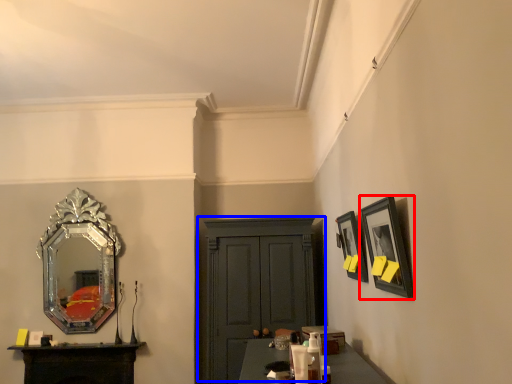
Question: Which object is closer to the camera taking this photo, picture frame (highlighted by a red box) or cabinetry (highlighted by a blue box)?

Choices:
 (A) picture frame
 (B) cabinetry

Answer: (A)